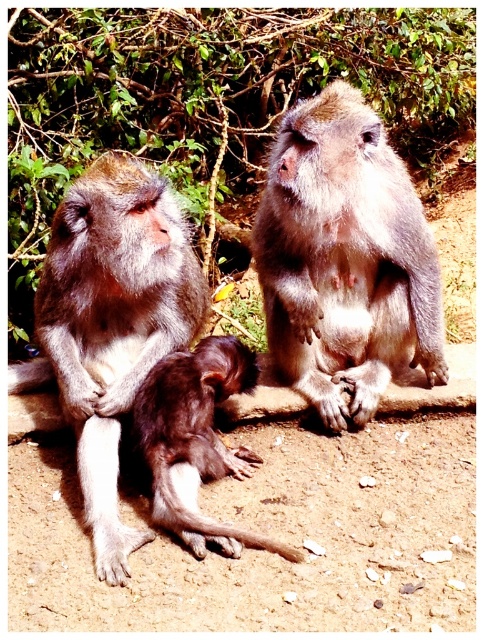
Where is the gray furry monkey at center located in the image?

The gray furry monkey at center is located at point (345,259) in the image.

You are standing in front of the gray furry monkey at center and want to toss a banana to it without getting too close. If the banana can travel 2 meters, will it reach the monkey?

The gray furry monkey at center is 2.40 meters away from the viewer. Since the banana can travel 2 meters, it won not reach the monkey.